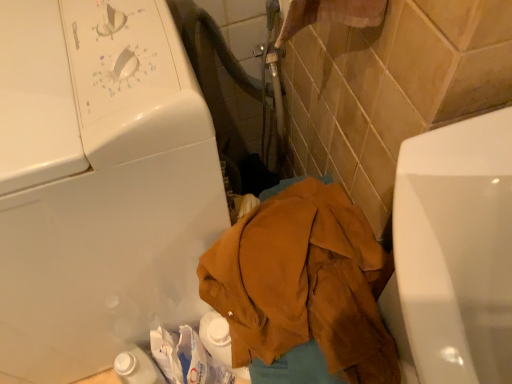
Question: Is white glossy washing machine at upper left wider than brown corduroy jacket at center?

Choices:
 (A) no
 (B) yes

Answer: (B)

Question: From the image's perspective, is white glossy washing machine at upper left under brown corduroy jacket at center?

Choices:
 (A) yes
 (B) no

Answer: (B)

Question: Is brown corduroy jacket at center at the back of white glossy washing machine at upper left?

Choices:
 (A) no
 (B) yes

Answer: (A)

Question: Is white glossy washing machine at upper left further to the viewer compared to brown corduroy jacket at center?

Choices:
 (A) no
 (B) yes

Answer: (A)

Question: Considering the relative sizes of white glossy washing machine at upper left and brown corduroy jacket at center in the image provided, is white glossy washing machine at upper left shorter than brown corduroy jacket at center?

Choices:
 (A) no
 (B) yes

Answer: (A)

Question: Considering the relative sizes of white glossy washing machine at upper left and brown corduroy jacket at center in the image provided, is white glossy washing machine at upper left taller than brown corduroy jacket at center?

Choices:
 (A) no
 (B) yes

Answer: (B)

Question: From a real-world perspective, is brown corduroy jacket at center beneath white glossy washing machine at upper left?

Choices:
 (A) no
 (B) yes

Answer: (B)

Question: Does brown corduroy jacket at center lie behind white glossy washing machine at upper left?

Choices:
 (A) no
 (B) yes

Answer: (B)

Question: Considering the relative sizes of brown corduroy jacket at center and white glossy washing machine at upper left in the image provided, is brown corduroy jacket at center bigger than white glossy washing machine at upper left?

Choices:
 (A) yes
 (B) no

Answer: (B)

Question: Is brown corduroy jacket at center oriented towards white glossy washing machine at upper left?

Choices:
 (A) no
 (B) yes

Answer: (A)

Question: From the image's perspective, would you say brown corduroy jacket at center is positioned over white glossy washing machine at upper left?

Choices:
 (A) yes
 (B) no

Answer: (B)

Question: Is brown corduroy jacket at center not close to white glossy washing machine at upper left?

Choices:
 (A) yes
 (B) no

Answer: (B)

Question: Is point (1, 235) closer or farther from the camera than point (257, 221)?

Choices:
 (A) farther
 (B) closer

Answer: (B)